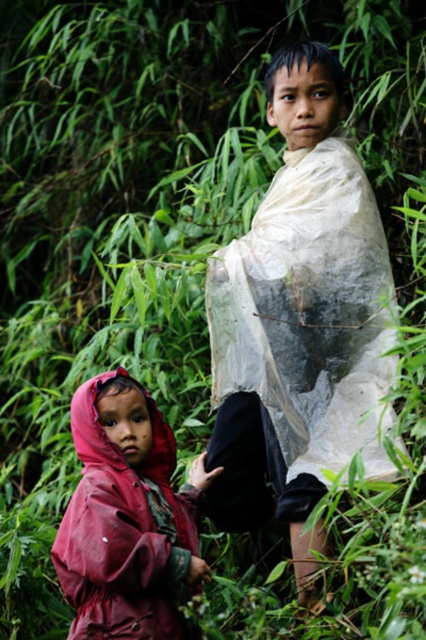
Can you confirm if white plastic bag at center is positioned to the left of rubberized red raincoat at lower left?

Incorrect, white plastic bag at center is not on the left side of rubberized red raincoat at lower left.

Who is positioned more to the left, white plastic bag at center or rubberized red raincoat at lower left?

Positioned to the left is rubberized red raincoat at lower left.

Describe the element at coordinates (299, 321) in the screenshot. This screenshot has height=640, width=426. I see `white plastic bag at center` at that location.

I want to click on white plastic bag at center, so [299, 321].